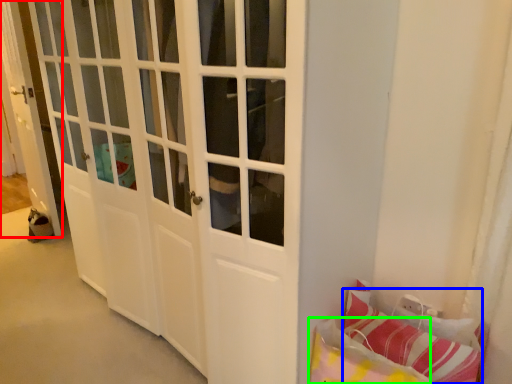
Question: Which object is the closest to the door (highlighted by a red box)? Choose among these: pillow (highlighted by a blue box) or pillow (highlighted by a green box).

Choices:
 (A) pillow
 (B) pillow

Answer: (B)